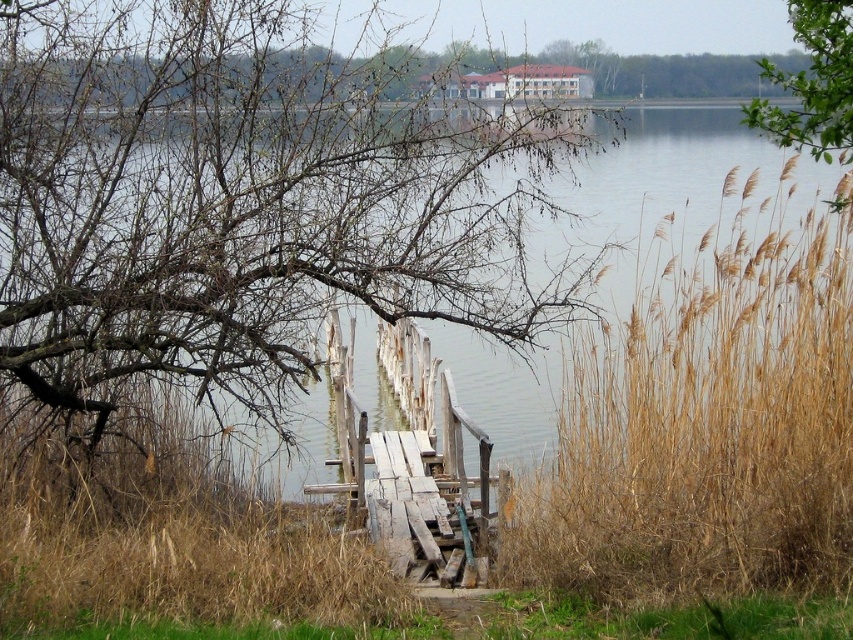
From the picture: How much distance is there between dry grass at right and green leafy branch at upper right?

dry grass at right is 3.42 meters from green leafy branch at upper right.

Between dry grass at right and green leafy branch at upper right, which one is positioned higher?

green leafy branch at upper right is higher up.

What do you see at coordinates (706, 432) in the screenshot? I see `dry grass at right` at bounding box center [706, 432].

Find the location of a particular element. dry grass at right is located at coordinates (706, 432).

Does dry grass at lower center have a smaller size compared to bare branches at upper center?

Yes, dry grass at lower center is smaller than bare branches at upper center.

Looking at this image, is dry grass at lower center wider than bare branches at upper center?

Indeed, dry grass at lower center has a greater width compared to bare branches at upper center.

Does point (500, 636) come closer to viewer compared to point (668, 65)?

That is True.

This screenshot has height=640, width=853. In order to click on dry grass at lower center in this screenshot , I will do pyautogui.click(x=523, y=621).

Is point (381, 115) closer to camera compared to point (817, 32)?

No, (381, 115) is behind (817, 32).

How much distance is there between brown/dry wood tree at center and green leafy branch at upper right?

They are 3.61 meters apart.

The height and width of the screenshot is (640, 853). I want to click on brown/dry wood tree at center, so click(x=242, y=202).

Locate an element on the screen. The image size is (853, 640). brown/dry wood tree at center is located at coordinates (242, 202).